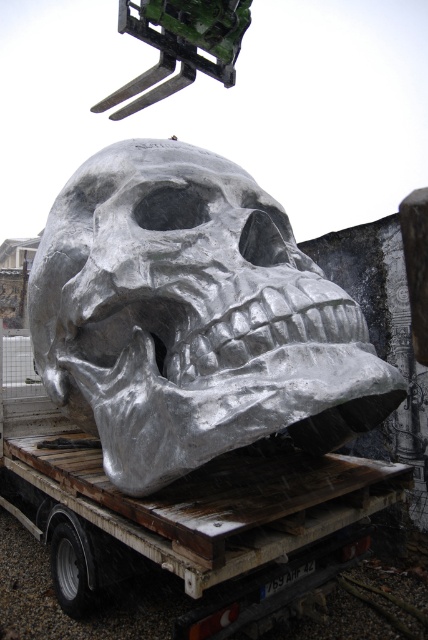
Question: Does shiny metallic skull at center appear under metallic silver trailer truck at center?

Choices:
 (A) no
 (B) yes

Answer: (A)

Question: Observing the image, what is the correct spatial positioning of shiny metallic skull at center in reference to metallic silver trailer truck at center?

Choices:
 (A) below
 (B) above

Answer: (B)

Question: Among these objects, which one is nearest to the camera?

Choices:
 (A) metallic silver trailer truck at center
 (B) shiny metallic skull at center

Answer: (A)

Question: Among these objects, which one is nearest to the camera?

Choices:
 (A) shiny metallic skull at center
 (B) metallic silver trailer truck at center

Answer: (B)

Question: Where is shiny metallic skull at center located in relation to metallic silver trailer truck at center in the image?

Choices:
 (A) left
 (B) right

Answer: (B)